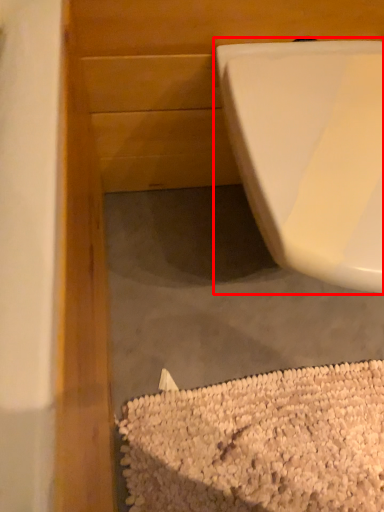
Question: From the image's perspective, considering the relative positions of toilet (annotated by the red box) and debris in the image provided, where is toilet (annotated by the red box) located with respect to the staircase?

Choices:
 (A) above
 (B) below

Answer: (A)